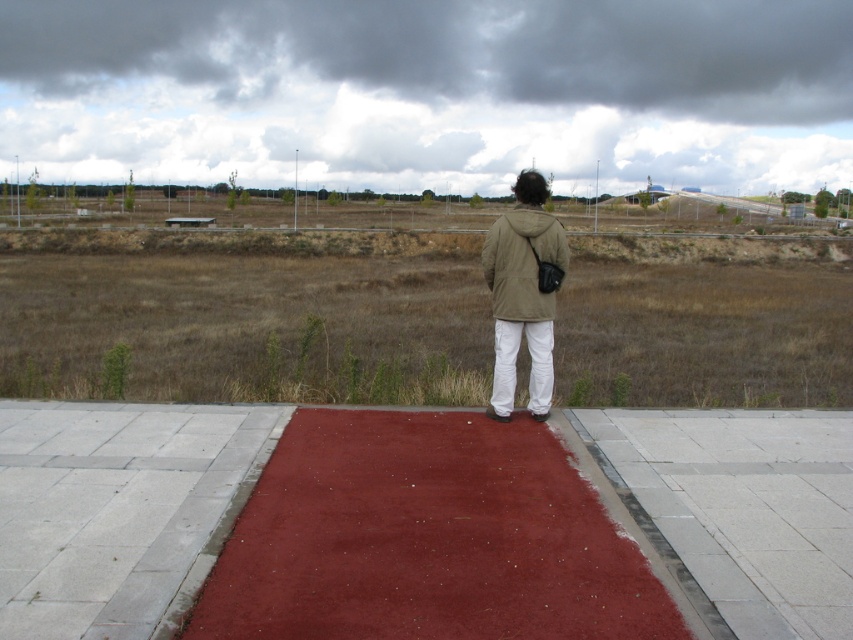
You are standing at the end of the red pathway and want to walk straight ahead towards the open field. According to the image, is the smooth concrete pavement at lower center directly in front of you or to the side?

The smooth concrete pavement at lower center is directly in front of you because it is positioned at point (115,509), which aligns with the center area directly ahead.

In the scene shown: You are a hiker trying to decide which jacket to wear for your trip. You have two jackets in your backpack labeled as matte khaki jacket at center and khaki matte jacket at center. According to the scene you observed, which jacket is positioned to the right?

The matte khaki jacket at center is positioned to the right of the khaki matte jacket at center.